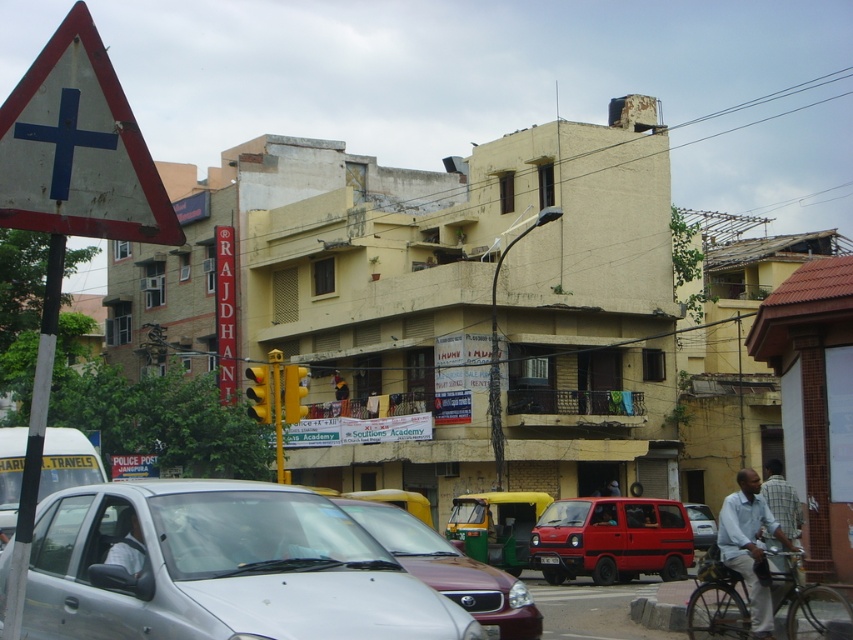
Does point (91, 202) come in front of point (674, 564)?

Yes, point (91, 202) is closer to viewer.

Is white matte triangle at upper left shorter than red matte van at center?

No, white matte triangle at upper left is not shorter than red matte van at center.

In order to click on white matte triangle at upper left in this screenshot , I will do `click(78, 147)`.

Between red matte van at center and matte red van at center, which one is positioned lower?

matte red van at center is lower down.

Looking at this image, between red matte van at center and matte red van at center, which one has less height?

Standing shorter between the two is matte red van at center.

Which is in front, point (531, 545) or point (695, 531)?

Point (531, 545) is in front.

Locate an element on the screen. red matte van at center is located at coordinates (612, 540).

Is silver metallic car at center below white matte triangle at upper left?

Indeed, silver metallic car at center is positioned under white matte triangle at upper left.

Is silver metallic car at center behind white matte triangle at upper left?

Yes, silver metallic car at center is behind white matte triangle at upper left.

Is point (270, 566) behind point (160, 220)?

Yes, it is.

This screenshot has height=640, width=853. What are the coordinates of `silver metallic car at center` in the screenshot? It's located at (222, 568).